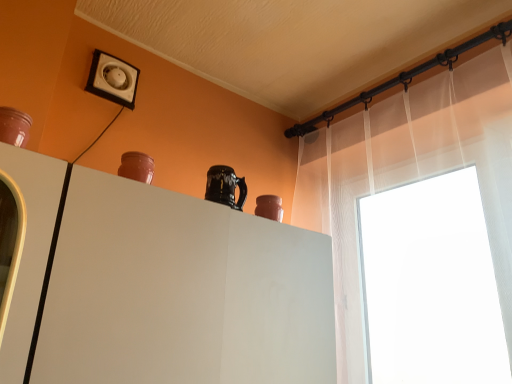
Question: Should I look upward or downward to see white matte cabinet at center?

Choices:
 (A) down
 (B) up

Answer: (A)

Question: Considering the relative positions of matte clay vase at upper right, acting as the 2th vase starting from the front, and sheer white curtain at upper right in the image provided, is matte clay vase at upper right, acting as the 2th vase starting from the front, to the right of sheer white curtain at upper right from the viewer's perspective?

Choices:
 (A) yes
 (B) no

Answer: (B)

Question: Is the position of matte clay vase at upper right, acting as the 2th vase starting from the front, more distant than that of sheer white curtain at upper right?

Choices:
 (A) yes
 (B) no

Answer: (A)

Question: Is matte clay vase at upper right, marked as the second vase in a top-to-bottom arrangement, looking in the opposite direction of sheer white curtain at upper right?

Choices:
 (A) no
 (B) yes

Answer: (A)

Question: Is matte clay vase at upper right, marked as the second vase in a top-to-bottom arrangement, touching sheer white curtain at upper right?

Choices:
 (A) yes
 (B) no

Answer: (B)

Question: Is matte clay vase at upper right, the 2th vase from the left, bigger than sheer white curtain at upper right?

Choices:
 (A) no
 (B) yes

Answer: (A)

Question: Can you confirm if matte clay vase at upper right, the 2th vase from the left, is smaller than sheer white curtain at upper right?

Choices:
 (A) no
 (B) yes

Answer: (B)

Question: Does white matte cabinet at center appear on the right side of matte brown vase at upper left, which is the 1th vase from front to back?

Choices:
 (A) yes
 (B) no

Answer: (A)

Question: Considering the relative sizes of white matte cabinet at center and matte brown vase at upper left, the second vase positioned from the back, in the image provided, is white matte cabinet at center thinner than matte brown vase at upper left, the second vase positioned from the back,?

Choices:
 (A) yes
 (B) no

Answer: (B)

Question: Is white matte cabinet at center oriented away from matte brown vase at upper left, which is counted as the second vase, starting from the right?

Choices:
 (A) yes
 (B) no

Answer: (B)

Question: Can you see white matte cabinet at center touching matte brown vase at upper left, acting as the 1th vase starting from the top?

Choices:
 (A) yes
 (B) no

Answer: (B)

Question: Can you confirm if white matte cabinet at center is bigger than matte brown vase at upper left, the second vase positioned from the back?

Choices:
 (A) yes
 (B) no

Answer: (A)

Question: From a real-world perspective, is white matte cabinet at center located beneath matte brown vase at upper left, the 2th vase in the bottom-to-top sequence?

Choices:
 (A) no
 (B) yes

Answer: (B)

Question: Is matte clay vase at upper right, acting as the 2th vase starting from the front, closer to camera compared to white plastic electric outlet at upper left?

Choices:
 (A) yes
 (B) no

Answer: (A)